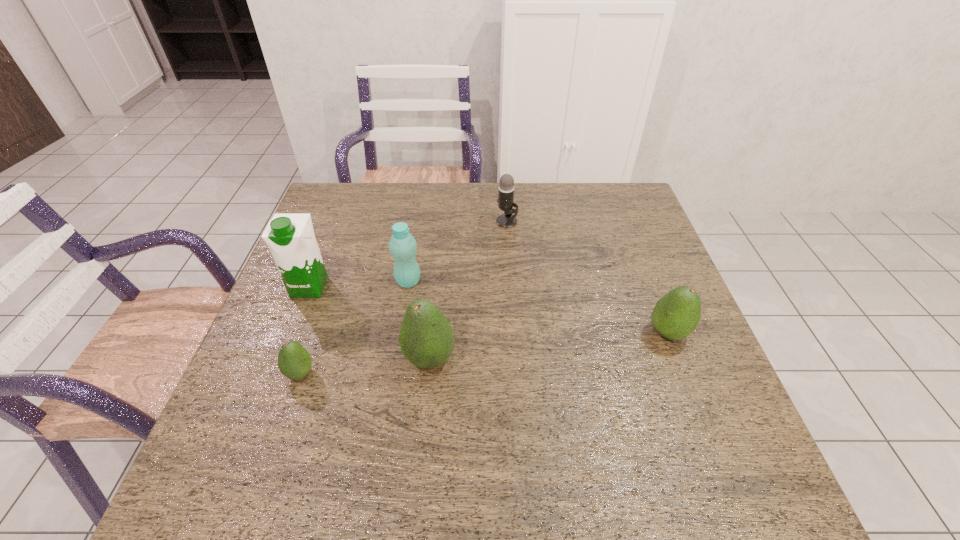
This screenshot has width=960, height=540. In the image, there is a desktop. What are the coordinates of `vacant space at the near edge` in the screenshot? It's located at (462, 420).

Where is `vacant space at the right edge`? vacant space at the right edge is located at coordinates (684, 376).

Where is `vacant space at the far left corner of the desktop`? This screenshot has height=540, width=960. vacant space at the far left corner of the desktop is located at coordinates (368, 187).

Where is `vacant area at the near right corner`? The width and height of the screenshot is (960, 540). vacant area at the near right corner is located at coordinates (739, 428).

Identify the location of unoccupied area between the rightmost object and the second avocado from left to right. The image size is (960, 540). (549, 346).

Locate an element on the screen. vacant area that lies between the bottle and the second shortest avocado is located at coordinates (539, 307).

Identify the location of unoccupied area between the bottle and the rightmost avocado. (539, 307).

The width and height of the screenshot is (960, 540). Identify the location of vacant area that lies between the shortest object and the bottle. (354, 327).

I want to click on vacant area between the shortest object and the bottle, so click(x=354, y=327).

I want to click on vacant point located between the leftmost avocado and the second avocado from left to right, so click(x=365, y=366).